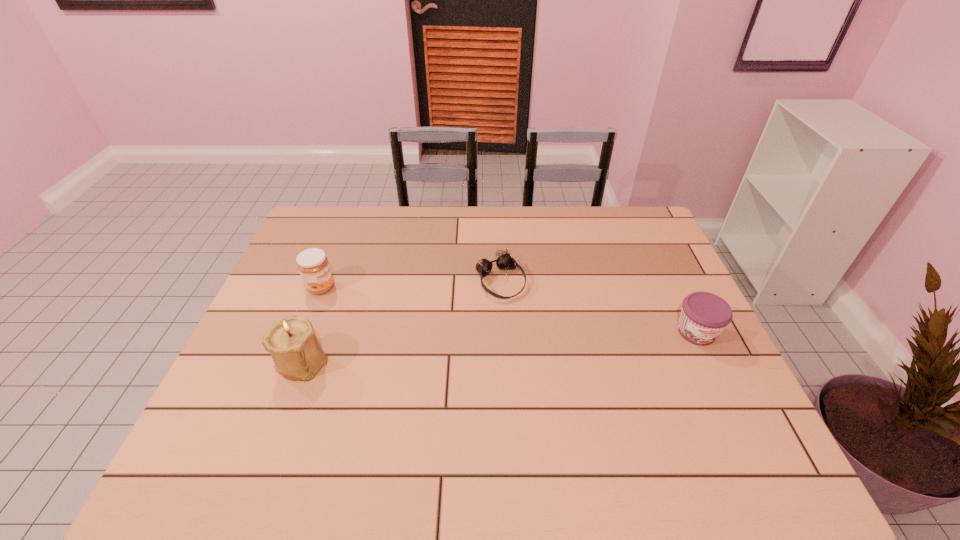
Identify the location of vacant position located 0.150m on the front label of the third shortest object. The image size is (960, 540). (373, 308).

Locate an element on the screen. free space located on the front label of the third shortest object is located at coordinates (385, 313).

You are a GUI agent. You are given a task and a screenshot of the screen. Output one action in this format:
    pyautogui.click(x=<x>, y=<y>)
    Task: Click on the vacant space located 0.070m through the lenses of the goggles
    The height and width of the screenshot is (540, 960).
    Given the screenshot: What is the action you would take?
    pyautogui.click(x=524, y=316)

In order to click on vacant space located through the lenses of the goggles in this screenshot , I will do (x=582, y=395).

Where is `free point located 0.390m through the lenses of the goggles`? This screenshot has height=540, width=960. free point located 0.390m through the lenses of the goggles is located at coordinates point(592,409).

What are the coordinates of `candle_holder present at the left edge` in the screenshot? It's located at (292, 343).

Find the location of a particular element. The width and height of the screenshot is (960, 540). jam situated at the left edge is located at coordinates (313, 265).

Identify the location of object positioned at the right edge. The height and width of the screenshot is (540, 960). (704, 315).

In the image, there is a desktop. Where is `vacant space at the far edge`? The height and width of the screenshot is (540, 960). vacant space at the far edge is located at coordinates (578, 232).

Where is `free space at the left edge`? free space at the left edge is located at coordinates (253, 357).